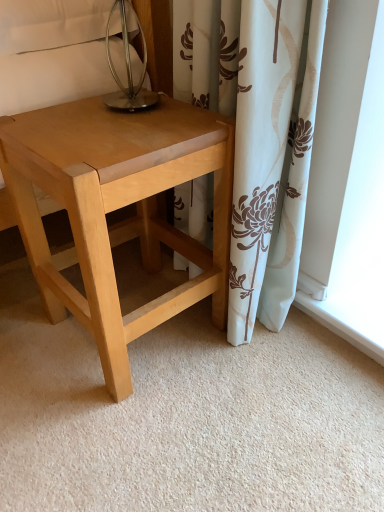
Measure the distance between point [82,164] and camera.

Point [82,164] is 25.12 inches away from camera.

Describe the element at coordinates (118, 208) in the screenshot. I see `light wood stool at center` at that location.

What is the approximate width of light wood stool at center?

The width of light wood stool at center is 35.52 centimeters.

Where is `light wood stool at center`? This screenshot has height=512, width=384. light wood stool at center is located at coordinates (118, 208).

Locate an element on the screen. light wood stool at center is located at coordinates (118, 208).